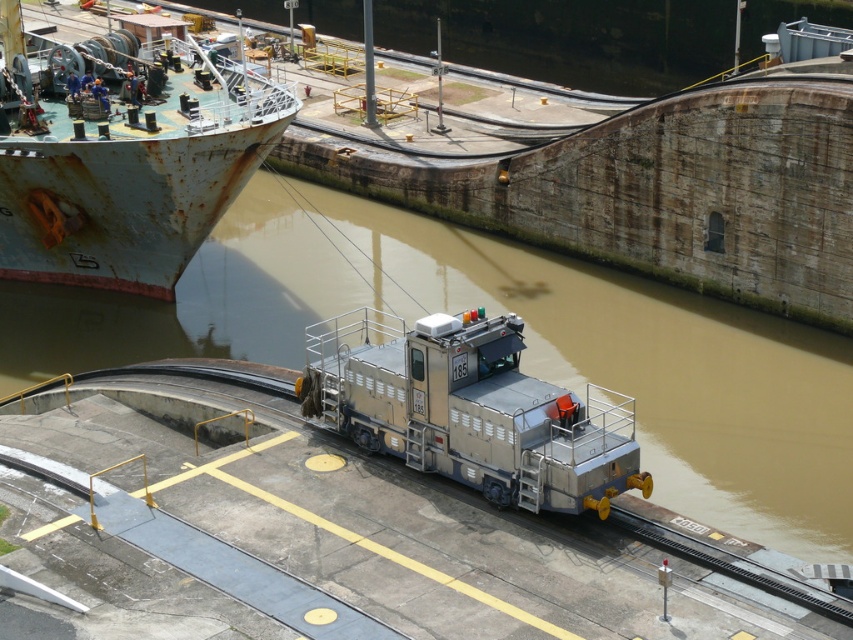
Question: Does brown matte water at center appear over metallic gray locomotive at center?

Choices:
 (A) no
 (B) yes

Answer: (B)

Question: Based on their relative distances, which object is farther from the metallic gray locomotive at center?

Choices:
 (A) brown matte water at center
 (B) rusty metal ship at upper left

Answer: (B)

Question: Is rusty metal ship at upper left positioned before metallic gray locomotive at center?

Choices:
 (A) yes
 (B) no

Answer: (B)

Question: Which point is closer to the camera?

Choices:
 (A) rusty metal ship at upper left
 (B) metallic gray locomotive at center

Answer: (B)

Question: Observing the image, what is the correct spatial positioning of rusty metal ship at upper left in reference to metallic gray locomotive at center?

Choices:
 (A) left
 (B) right

Answer: (A)

Question: Which of the following is the farthest from the observer?

Choices:
 (A) brown matte water at center
 (B) rusty metal ship at upper left

Answer: (B)